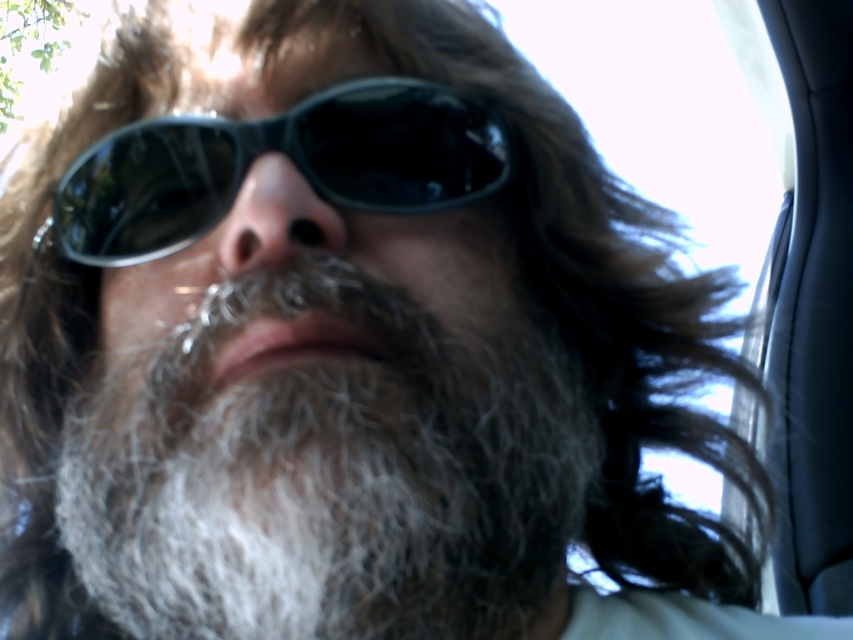
You are a photographer trying to capture a close detail shot of the facial features. Given that the gray fuzzy beard at center and the black plastic sunglasses at center are in the frame, which one would you focus on to ensure the subject is sharp, considering their relative sizes?

The gray fuzzy beard at center has a larger size compared to the black plastic sunglasses at center, so focusing on the gray fuzzy beard at center would ensure the subject is sharp as it occupies more of the frame.

Based on the scene description, if you were to draw a vertical line down the center of the face, which object would be positioned lower relative to the other between the gray fuzzy beard at center and the black plastic sunglasses at center?

The gray fuzzy beard at center is located below the black plastic sunglasses at center, so it is positioned lower.

You are a photographer trying to capture a clear shot of the black plastic sunglasses at center. However, the gray fuzzy beard at center is blocking your view. Can you adjust your angle to see the sunglasses without moving the subject?

The gray fuzzy beard at center is in front of the black plastic sunglasses at center, so adjusting your angle might allow you to see around the beard to capture the sunglasses without moving the subject.